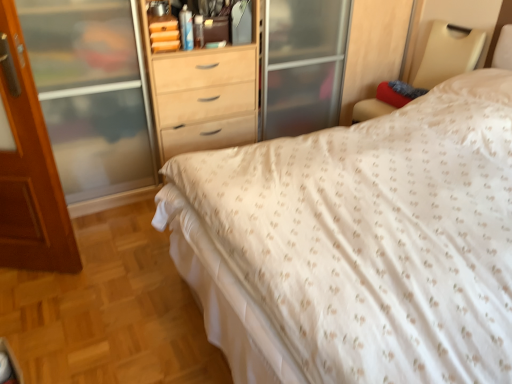
The height and width of the screenshot is (384, 512). I want to click on vacant area that is in front of brown wooden door at left, so click(x=32, y=302).